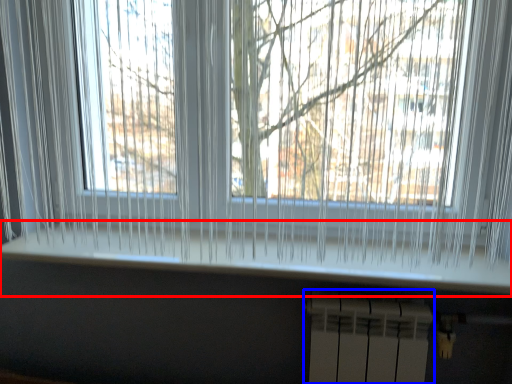
Question: Which object is closer to the camera taking this photo, window sill (highlighted by a red box) or radiator (highlighted by a blue box)?

Choices:
 (A) window sill
 (B) radiator

Answer: (A)